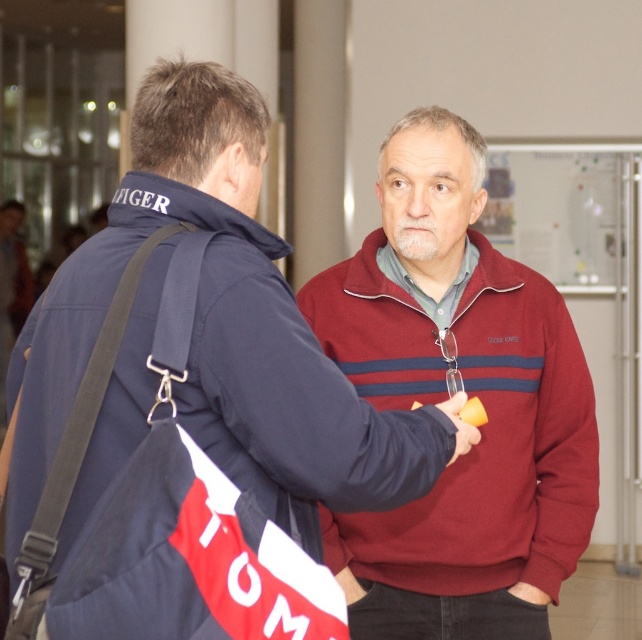
Is point (37, 403) less distant than point (15, 248)?

Yes.

This screenshot has height=640, width=642. Find the location of `maroon sweater at center`. maroon sweater at center is located at coordinates (227, 330).

Does burgundy fleece at center have a lesser width compared to blue fabric bag at left?

No.

Does burgundy fleece at center come in front of blue fabric bag at left?

Yes, burgundy fleece at center is closer to the viewer.

The image size is (642, 640). In order to click on burgundy fleece at center in this screenshot , I will do click(x=449, y=396).

Does burgundy fleece at center have a lesser height compared to maroon sweater at center?

No.

Does point (593, 490) come behind point (214, 156)?

Yes, it is.

The width and height of the screenshot is (642, 640). I want to click on burgundy fleece at center, so click(449, 396).